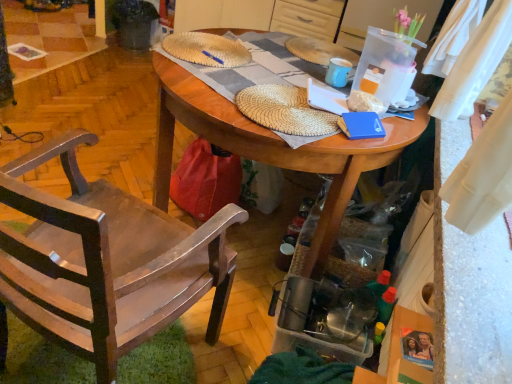
The image size is (512, 384). In order to click on vacant space behind blue plastic pen at center in this screenshot , I will do `click(218, 43)`.